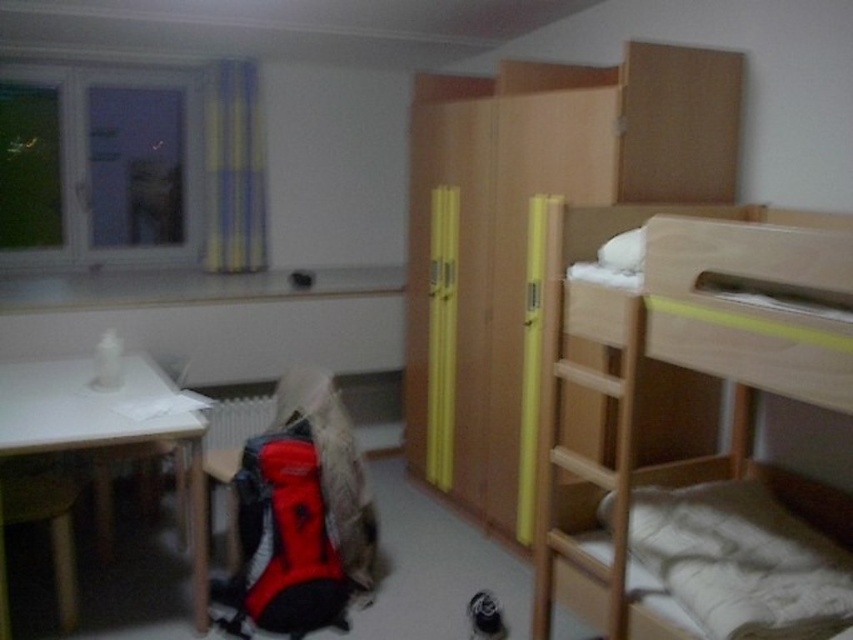
Question: Is light wood bunk bed at right positioned in front of white matte table at left?

Choices:
 (A) no
 (B) yes

Answer: (B)

Question: Which point appears closest to the camera in this image?

Choices:
 (A) (619, 602)
 (B) (200, 557)

Answer: (A)

Question: Is light wood bunk bed at right above white matte table at left?

Choices:
 (A) no
 (B) yes

Answer: (B)

Question: Which of the following is the closest to the observer?

Choices:
 (A) [4, 412]
 (B) [688, 244]

Answer: (B)

Question: Which point is closer to the camera taking this photo?

Choices:
 (A) (717, 376)
 (B) (18, 385)

Answer: (A)

Question: In this image, where is light wood bunk bed at right located relative to white matte table at left?

Choices:
 (A) below
 (B) above

Answer: (B)